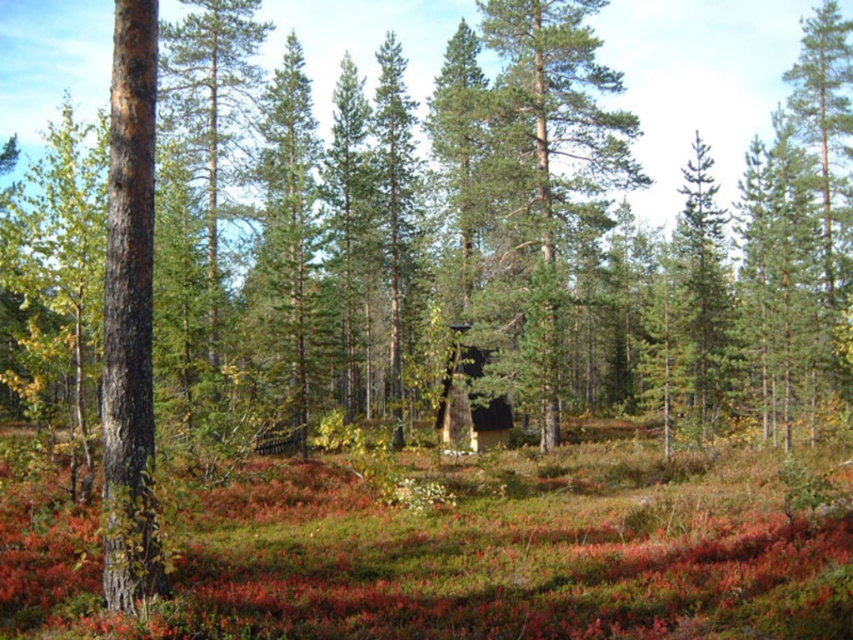
Question: Which of the following is the closest to the observer?

Choices:
 (A) green matte tree at center
 (B) green needle-like at center
 (C) green textured pine tree at center

Answer: (C)

Question: Which object appears closest to the camera in this image?

Choices:
 (A) green textured pine tree at center
 (B) green needle-like at center
 (C) green matte tree at center
 (D) smooth brown bark at left

Answer: (D)

Question: Considering the relative positions of smooth brown bark at left and green textured pine tree at center in the image provided, where is smooth brown bark at left located with respect to green textured pine tree at center?

Choices:
 (A) above
 (B) below

Answer: (B)

Question: Which of the following is the farthest from the observer?

Choices:
 (A) green needle-like at center
 (B) green matte tree at center
 (C) smooth brown bark at left
 (D) green textured pine tree at center

Answer: (A)

Question: Does smooth brown bark at left have a larger size compared to green matte tree at center?

Choices:
 (A) yes
 (B) no

Answer: (B)

Question: Does green needle-like at center appear on the left side of green textured pine tree at center?

Choices:
 (A) yes
 (B) no

Answer: (B)